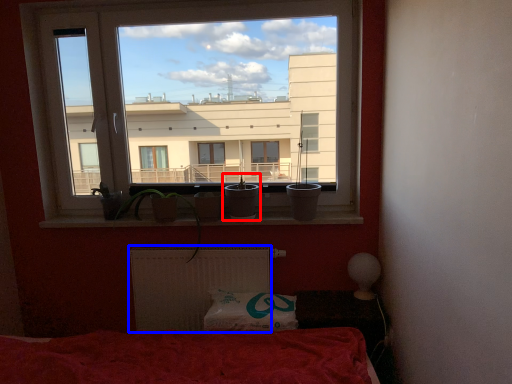
Question: Among these objects, which one is nearest to the camera, houseplant (highlighted by a red box) or radiator (highlighted by a blue box)?

Choices:
 (A) houseplant
 (B) radiator

Answer: (A)